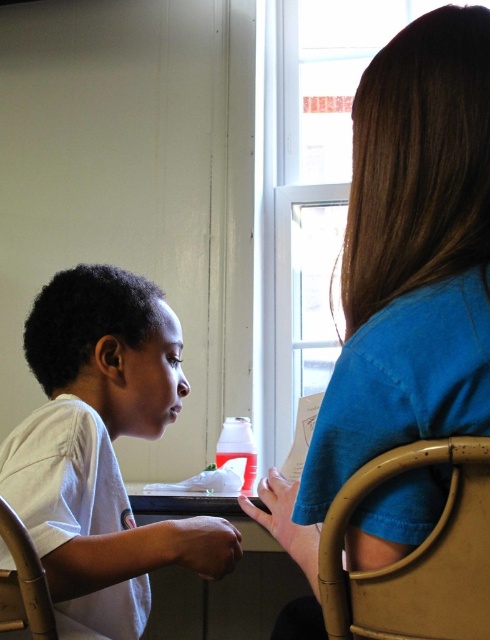
Can you confirm if smooth wooden table at center is thinner than wooden chair at lower left?

No.

Is smooth wooden table at center below wooden chair at lower left?

Yes.

You are a GUI agent. You are given a task and a screenshot of the screen. Output one action in this format:
    pyautogui.click(x=<x>, y=<y>)
    Task: Click on the smooth wooden table at center
    
    Given the screenshot: What is the action you would take?
    pyautogui.click(x=219, y=580)

This screenshot has height=640, width=490. Identify the location of smooth wooden table at center. (219, 580).

In the scene shown: Between blue cotton shirt at upper right and wooden chair at lower left, which one has less height?

wooden chair at lower left is shorter.

Is point (473, 64) closer to camera compared to point (32, 563)?

Yes, it is.

Is point (481, 92) closer to viewer compared to point (8, 620)?

Yes, it is in front of point (8, 620).

The height and width of the screenshot is (640, 490). In order to click on blue cotton shirt at upper right in this screenshot , I will do `click(405, 269)`.

Can you confirm if blue cotton shirt at upper right is smaller than smooth wooden table at center?

Incorrect, blue cotton shirt at upper right is not smaller in size than smooth wooden table at center.

Does blue cotton shirt at upper right appear over smooth wooden table at center?

Yes, blue cotton shirt at upper right is above smooth wooden table at center.

Is point (344, 291) closer to viewer compared to point (279, 602)?

That is True.

Where is `blue cotton shirt at upper right`? This screenshot has width=490, height=640. blue cotton shirt at upper right is located at coordinates (405, 269).